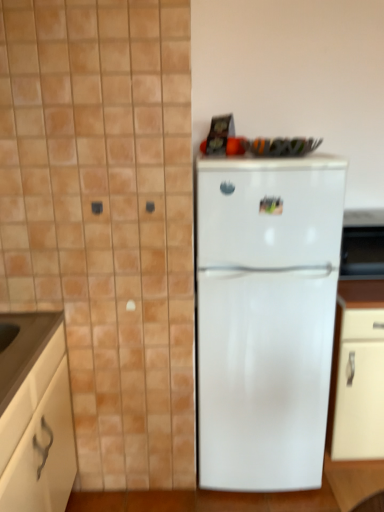
Question: Which is correct: white glossy refrigerator at center is inside white matte cabinet at lower left, or outside of it?

Choices:
 (A) outside
 (B) inside

Answer: (A)

Question: Considering the positions of white glossy refrigerator at center and white matte cabinet at lower left in the image, is white glossy refrigerator at center taller or shorter than white matte cabinet at lower left?

Choices:
 (A) short
 (B) tall

Answer: (B)

Question: From a real-world perspective, is white glossy refrigerator at center physically located above or below white matte cabinet at lower left?

Choices:
 (A) above
 (B) below

Answer: (A)

Question: Do you think white matte cabinet at lower left is within white glossy refrigerator at center, or outside of it?

Choices:
 (A) inside
 (B) outside

Answer: (B)

Question: Would you say white matte cabinet at lower left is to the left or to the right of white glossy refrigerator at center in the picture?

Choices:
 (A) left
 (B) right

Answer: (A)

Question: In terms of height, does white matte cabinet at lower left look taller or shorter compared to white glossy refrigerator at center?

Choices:
 (A) short
 (B) tall

Answer: (A)

Question: In terms of size, does white matte cabinet at lower left appear bigger or smaller than white glossy refrigerator at center?

Choices:
 (A) big
 (B) small

Answer: (B)